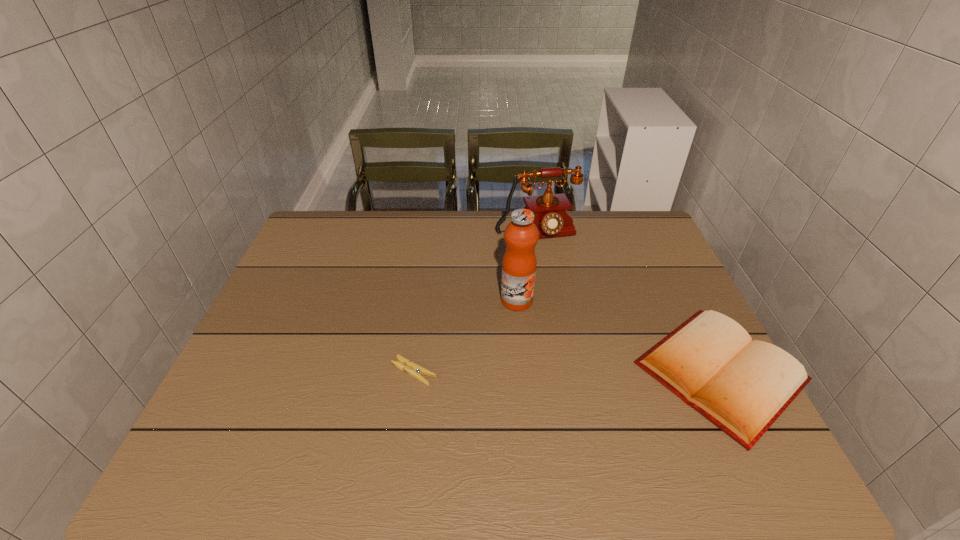
Locate an element on the screen. The image size is (960, 540). free space that satisfies the following two spatial constraints: 1. on the back side of the farthest object; 2. on the left side of the fruit juice is located at coordinates (511, 233).